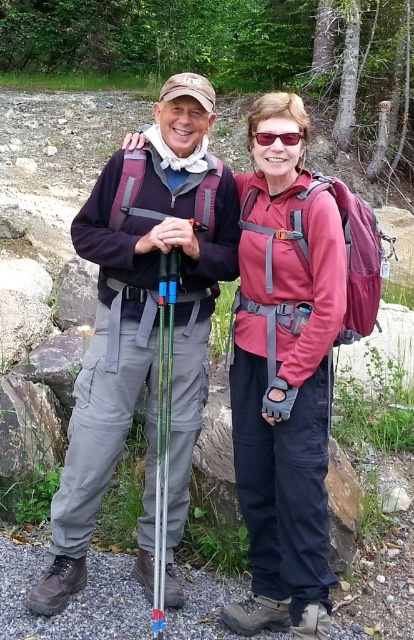
You are a hiker who needs to decide which item to pack first in your backpack. Based on the scene, which item takes up more space between the matte gray pants at center and the green metallic ski pole at center?

The matte gray pants at center has a larger size compared to the green metallic ski pole at center, so the matte gray pants at center takes up more space.

You are a photographer trying to capture a photo of the matte gray pants at center and the matte plastic sunglasses at center. Since you want to ensure both are in focus, you need to know which object is taller. Which one is taller?

The matte gray pants at center is much taller than the matte plastic sunglasses at center, so you should focus on the matte gray pants at center first as it is taller.

You are a photographer trying to capture a clear photo of the green metallic ski pole at center and the matte plastic sunglasses at center. Which object should you focus on first to ensure it appears sharp in the photo?

The green metallic ski pole at center is further to the viewer than the matte plastic sunglasses at center, so you should focus on the green metallic ski pole at center first to ensure it appears sharp in the photo.